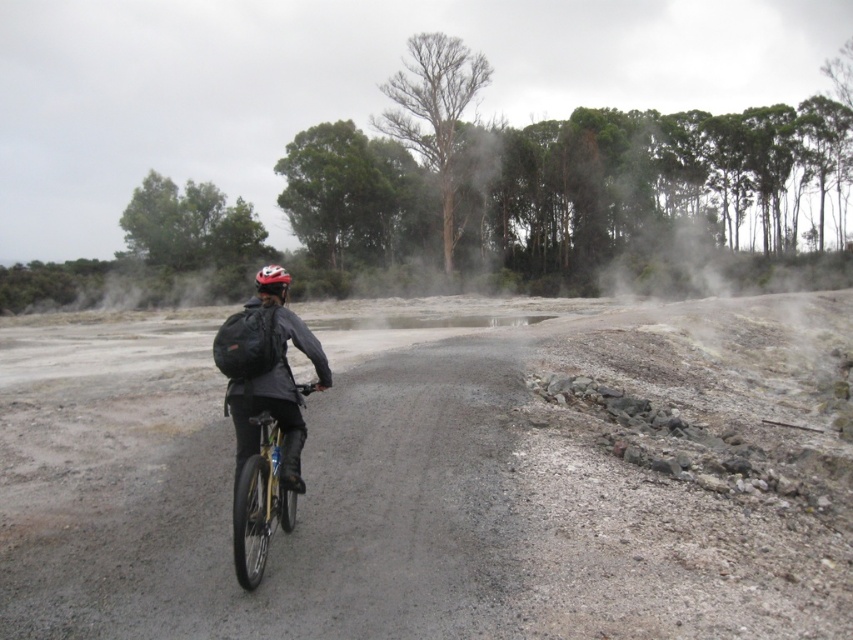
From the picture: You are a cyclist planning to ride your gold metallic bicycle at center along the gray gravel road at center. Based on the scene, can you safely ride your bicycle on the road without worrying about the width of the road?

The gray gravel road at center might be wider than gold metallic bicycle at center, so it is likely safe to ride the gold metallic bicycle at center on the gray gravel road at center without width concerns.

You are a cyclist planning to ride through the gray gravel road at center while wearing the matte black helmet at center. Based on the scene, is the helmet positioned above the road?

The gray gravel road at center is below the matte black helmet at center, so yes, the matte black helmet at center is positioned above the road.